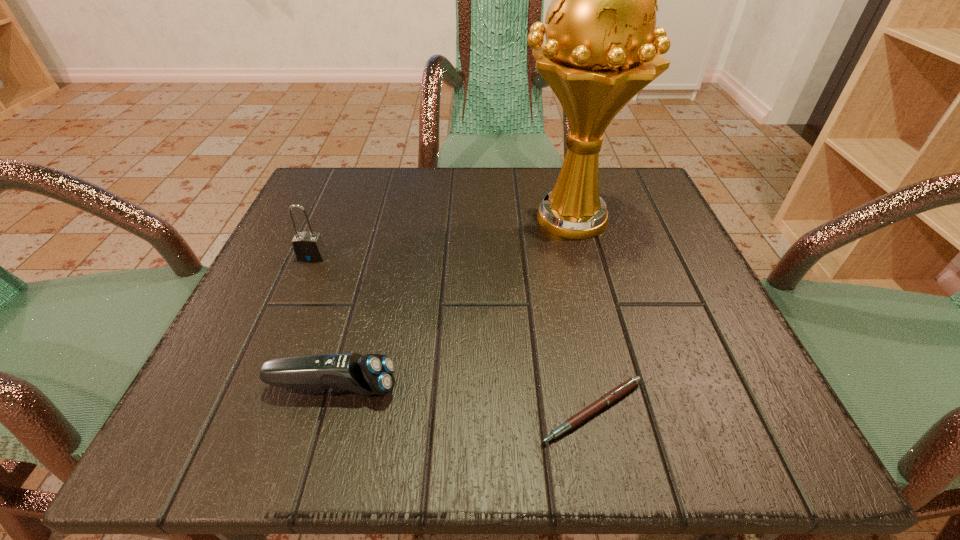
Identify the location of free location that satisfies the following two spatial constraints: 1. at the front of the tallest object where the globe is prominent; 2. at the nib of the pen. The height and width of the screenshot is (540, 960). (617, 410).